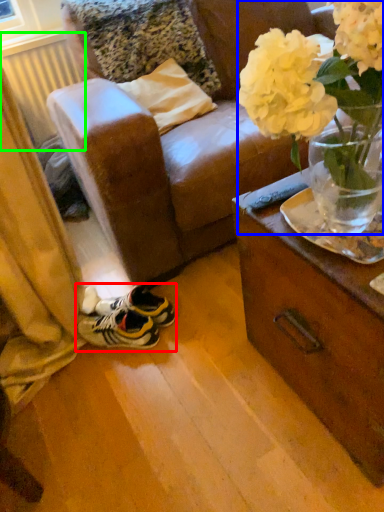
Question: Which is farther away from footwear (highlighted by a red box)? floral arrangement (highlighted by a blue box) or radiator (highlighted by a green box)?

Choices:
 (A) floral arrangement
 (B) radiator

Answer: (B)